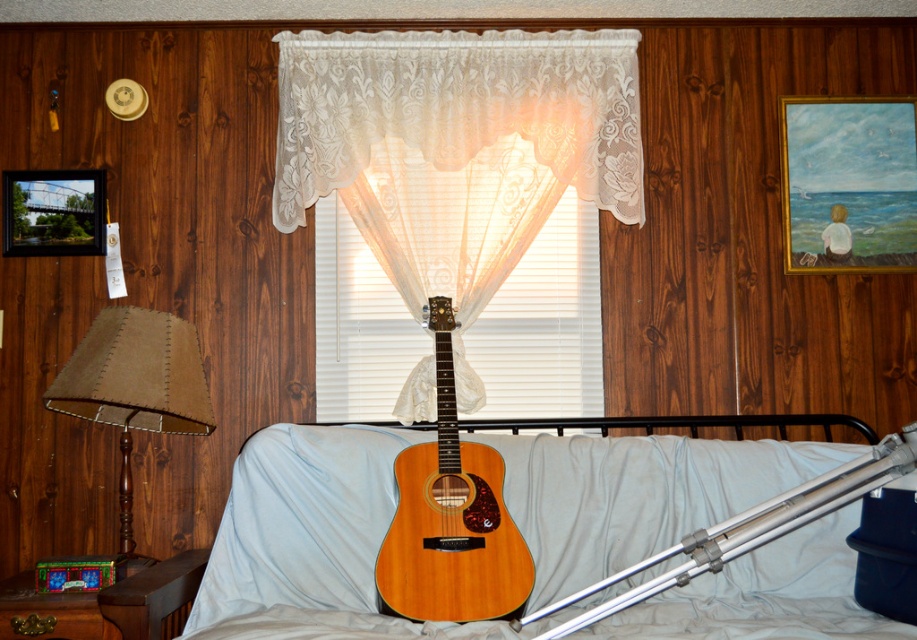
You are a delivery person who needs to place a package that is 25 inches long between the brown fabric lampshade at left and the metallic silver picture frame at upper left. Can the package fit between them without bending?

The distance between the brown fabric lampshade at left and the metallic silver picture frame at upper left is 24.08 inches. Since the package is 25 inches long, it cannot fit between them without bending.

You are an interior designer assessing the placement of furniture and decor in the room. The wooden bed at center and the wooden framed painting of child at upper right are both made of wood. Which object is positioned lower in the room?

The wooden bed at center is located below the wooden framed painting of child at upper right, so the wooden bed at center is positioned lower in the room.